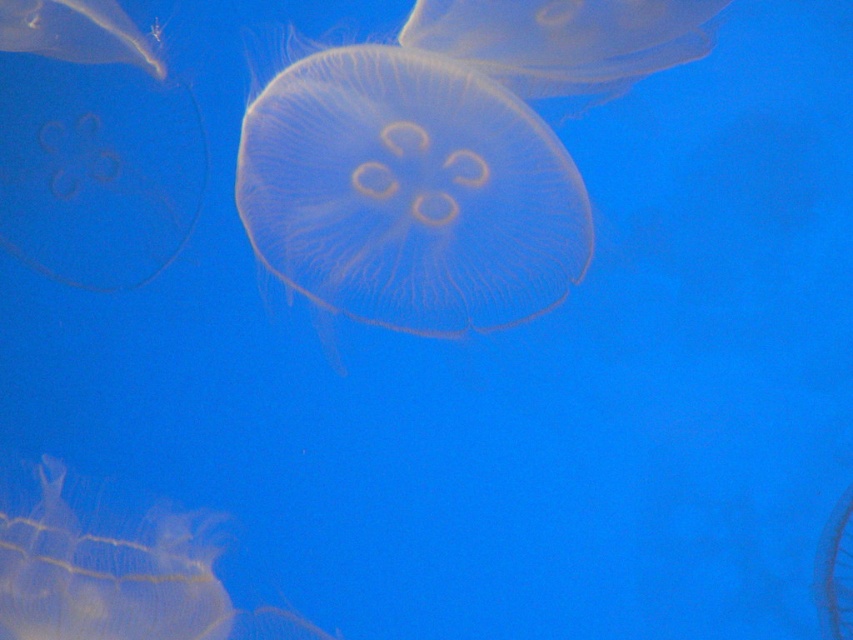
In the scene shown: You are an aquarium visitor observing the jellyfish tank. You notice two gelatinous creatures in the water. Which one is closer to you, the translucent gelatinous at lower left or the transparent gelatinous at upper left?

The translucent gelatinous at lower left is closer to you because it is in front of the transparent gelatinous at upper left.

You are an aquarium guide explaining the image to a visitor. You point to the point at coordinates point (x=409, y=193) and ask the visitor to identify what this point is located on. What should you tell them?

The point (x=409, y=193) is located on the translucent gelatinous at center.